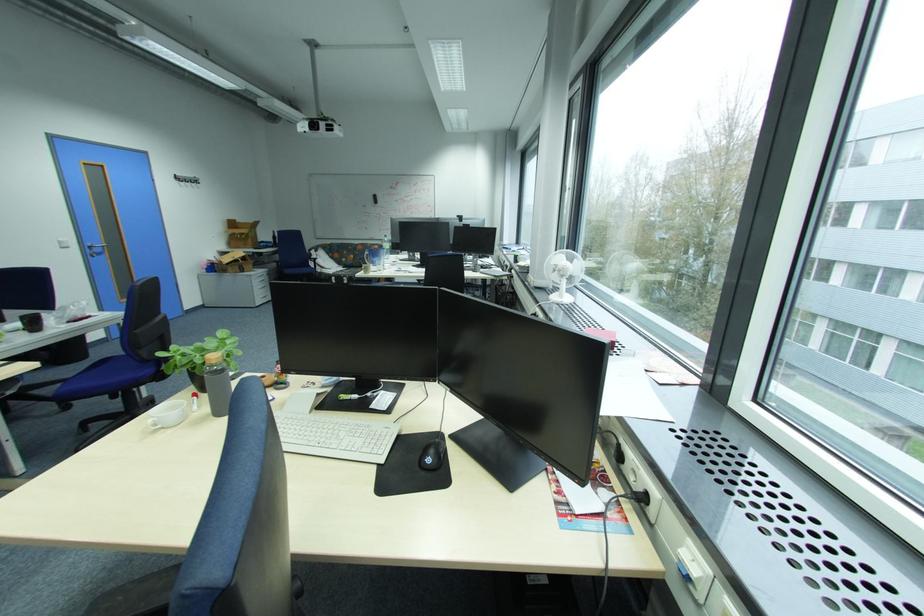
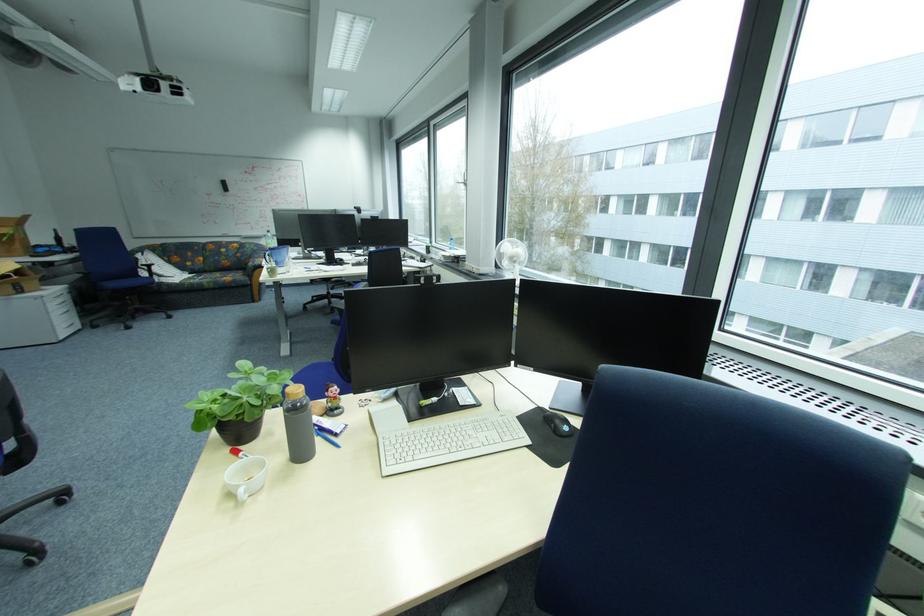
Locate, in the second image, the point that corresponds to pixel 326 440 in the first image.

(463, 445)